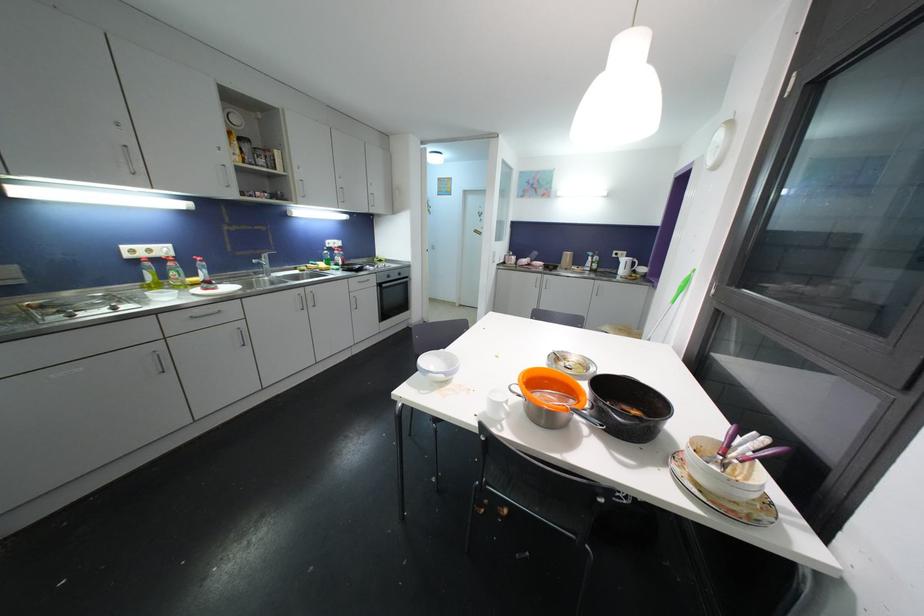
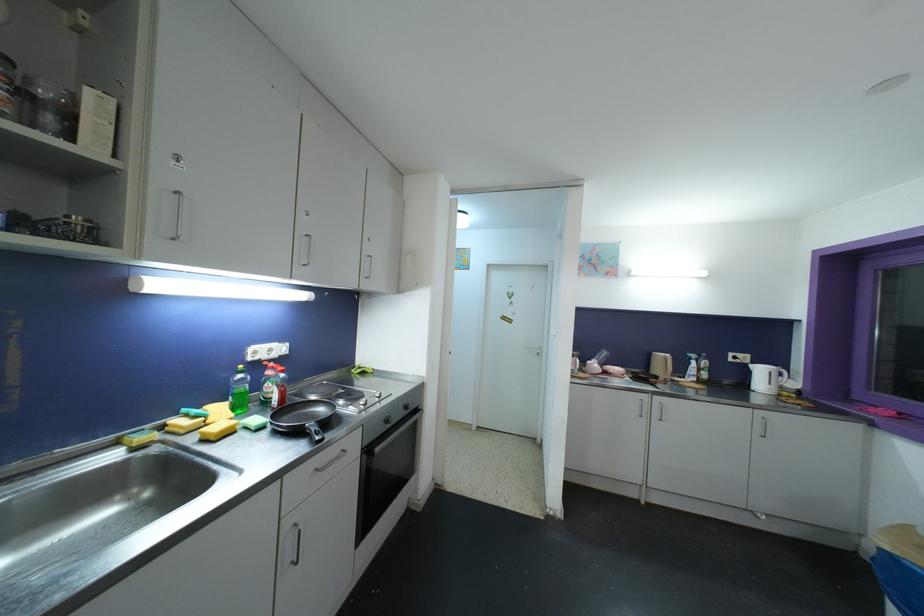
The point at (x=617, y=254) is marked in the first image. Where is the corresponding point in the second image?

(734, 357)